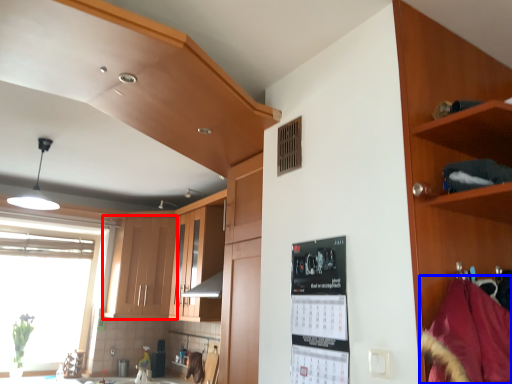
Question: Which object is closer to the camera taking this photo, cabinetry (highlighted by a red box) or material (highlighted by a blue box)?

Choices:
 (A) cabinetry
 (B) material

Answer: (B)